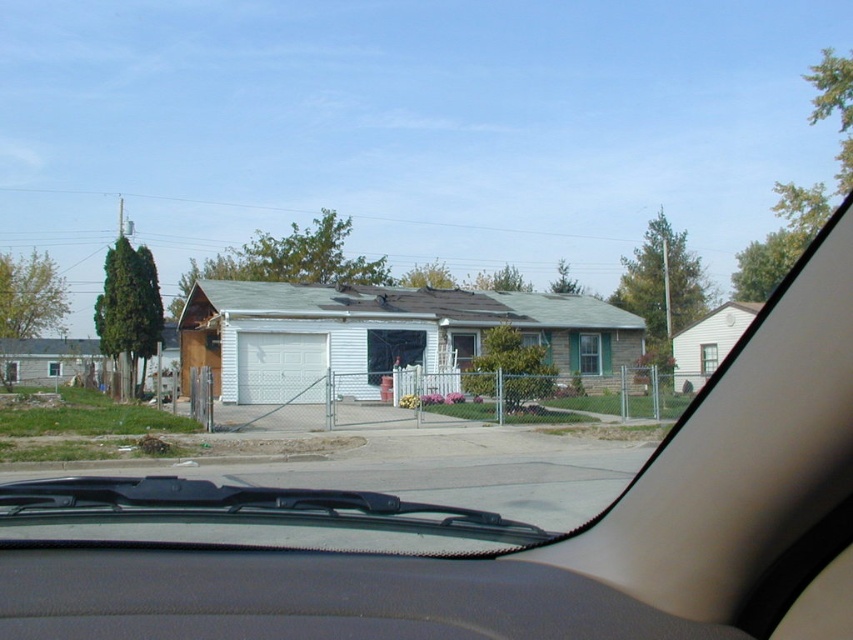
You are a delivery driver who needs to park your matte white car at center in a spot that requires precise positioning. The parking spot is located at coordinates 0.823, 0.600. Can you confirm if your car is already positioned correctly in the spot?

Yes, the matte white car at center is already positioned correctly at coordinates [511,525].

You are sitting in the driver seat of the matte white car at center. You want to check the GPS on the gray fabric dashboard at lower center. Can you reach it without moving your seat?

The gray fabric dashboard at lower center is behind the matte white car at center, so you cannot reach it without moving your seat.

You are a passenger in the car and notice a point at coordinates (312, 596). What object is located at that point?

The point at coordinates (312, 596) indicates the gray fabric dashboard at lower center.